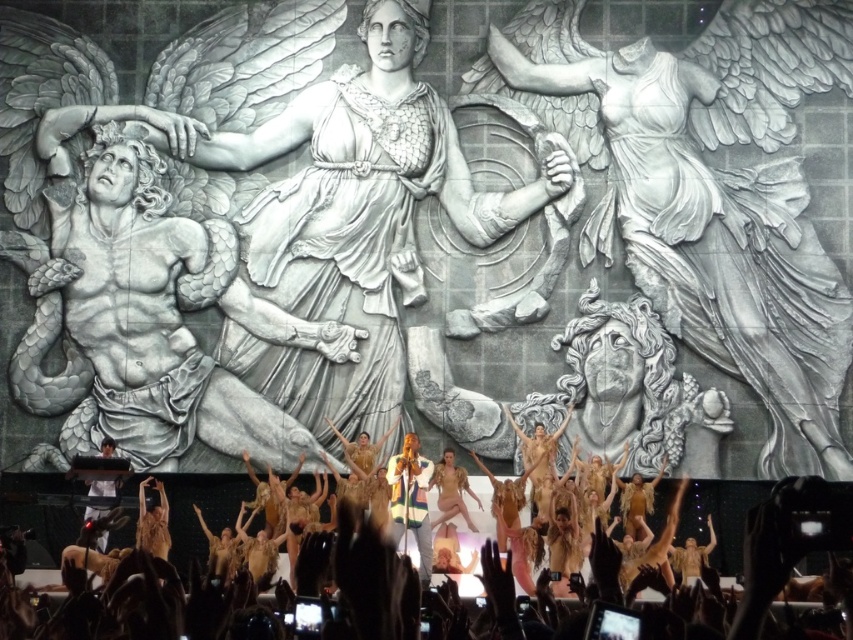
Question: Is brown feathered costumes at lower center smaller than white matte shirt at lower left?

Choices:
 (A) yes
 (B) no

Answer: (B)

Question: Which point appears closest to the camera in this image?

Choices:
 (A) (601, 572)
 (B) (305, 92)
 (C) (113, 488)

Answer: (A)

Question: Does white marble statue at center appear under gray stone man at left?

Choices:
 (A) yes
 (B) no

Answer: (B)

Question: Is the position of gray stone man at left more distant than that of white matte shirt at lower left?

Choices:
 (A) no
 (B) yes

Answer: (B)

Question: Which point is farther to the camera?

Choices:
 (A) brown feathered costumes at lower center
 (B) white matte shirt at lower left
 (C) gray stone man at left
 (D) white marble statue at center

Answer: (C)

Question: Which object is positioned farthest from the white marble statue at center?

Choices:
 (A) gray stone man at left
 (B) brown feathered costumes at lower center

Answer: (B)